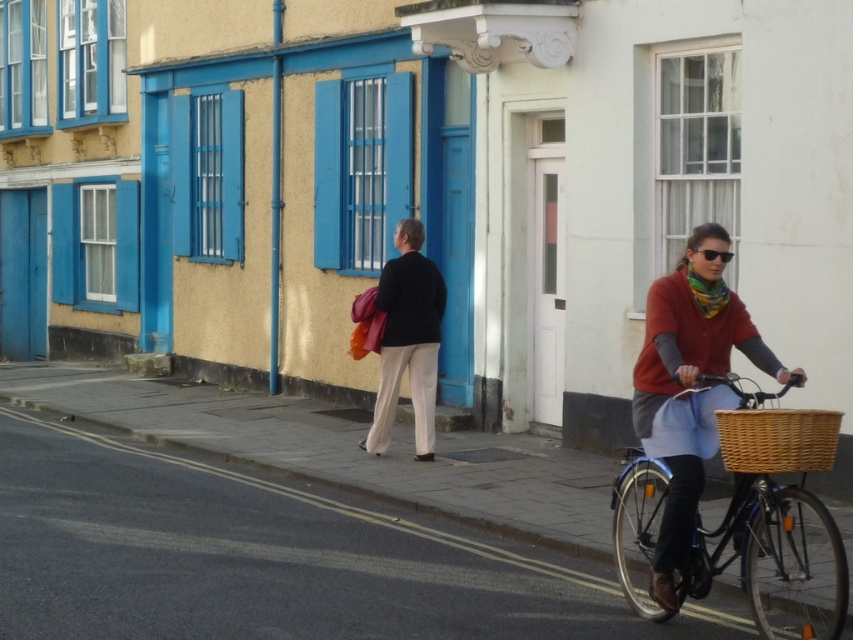
In the scene shown: Who is lower down, blue metallic bicycle at right or woven brown basket at right?

blue metallic bicycle at right is below.

Does blue metallic bicycle at right appear on the left side of woven brown basket at right?

No, blue metallic bicycle at right is not to the left of woven brown basket at right.

Who is more forward, (811, 577) or (730, 449)?

Point (730, 449)

Locate an element on the screen. This screenshot has height=640, width=853. blue metallic bicycle at right is located at coordinates (775, 557).

What are the coordinates of `matte red sweater at center` in the screenshot? It's located at (688, 394).

Who is shorter, matte red sweater at center or black plastic sunglasses at center?

black plastic sunglasses at center

Between point (695, 397) and point (722, 257), which one is positioned in front?

Point (722, 257) is more forward.

You are a GUI agent. You are given a task and a screenshot of the screen. Output one action in this format:
    pyautogui.click(x=<x>, y=<y>)
    Task: Click on the matte red sweater at center
    This screenshot has width=853, height=640.
    Given the screenshot: What is the action you would take?
    pyautogui.click(x=688, y=394)